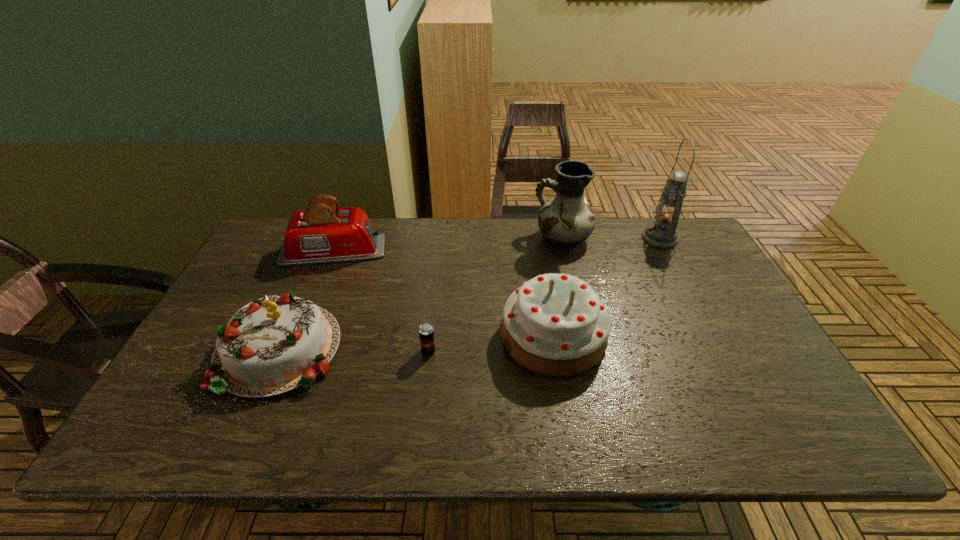
Find the location of a particular element. vacant space located 0.270m on the right of the toaster is located at coordinates (469, 251).

I want to click on free location located on the left of the right cake, so click(x=355, y=336).

The image size is (960, 540). Identify the location of vacant space located on the back of the left cake. (333, 227).

At what (x,y) coordinates should I click in order to perform the action: click on free location located on the back of the fourth object from right to left. Please return your answer as a coordinate pair (x, y). Looking at the image, I should click on (438, 274).

The image size is (960, 540). Find the location of `oil lamp positioned at the far edge`. oil lamp positioned at the far edge is located at coordinates tap(662, 233).

The width and height of the screenshot is (960, 540). In order to click on vase at the far edge in this screenshot , I will do `click(566, 221)`.

Find the location of a particular element. This screenshot has width=960, height=540. toaster that is at the far edge is located at coordinates (324, 233).

Identify the location of toaster positioned at the left edge. Image resolution: width=960 pixels, height=540 pixels. (324, 233).

This screenshot has width=960, height=540. What are the coordinates of `cake at the left edge` in the screenshot? It's located at (275, 344).

Where is `object present at the right edge`? object present at the right edge is located at coordinates (662, 233).